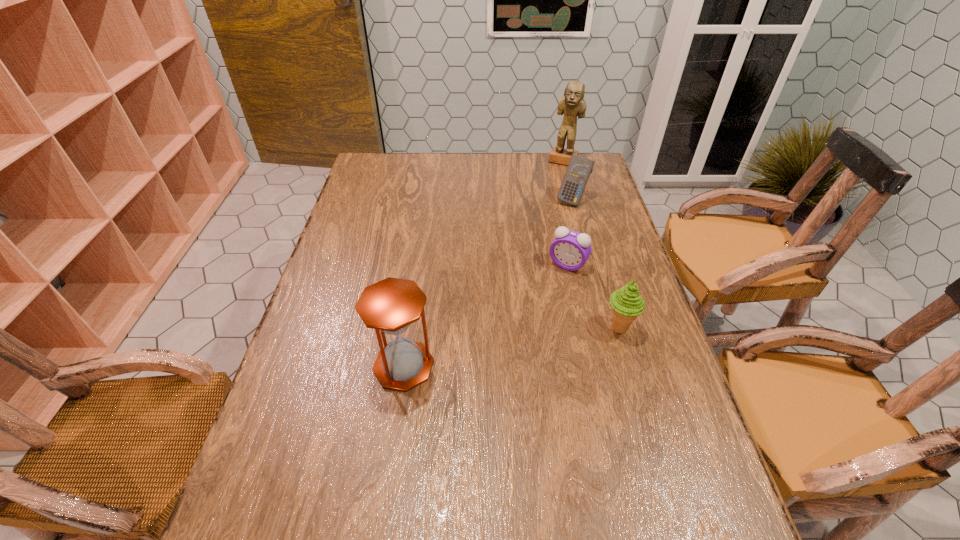
Find the location of a particular element. Image resolution: width=960 pixels, height=540 pixels. free space between the second nearest object and the second farthest object is located at coordinates (595, 264).

Image resolution: width=960 pixels, height=540 pixels. Identify the location of free space between the icecream and the fourth nearest object. (595, 264).

Locate an element on the screen. free spot between the calculator and the second tallest object is located at coordinates (488, 283).

Where is `free area in between the icecream and the hourglass`? This screenshot has width=960, height=540. free area in between the icecream and the hourglass is located at coordinates (512, 347).

Identify the location of empty space that is in between the alarm clock and the fourth shortest object. (486, 315).

Where is `vacant space that is in between the tallest object and the fourth farthest object`? Image resolution: width=960 pixels, height=540 pixels. vacant space that is in between the tallest object and the fourth farthest object is located at coordinates (591, 244).

Find the location of a particular element. This screenshot has height=540, width=960. free area in between the second farthest object and the hourglass is located at coordinates (488, 283).

Choose which object is the fourth nearest neighbor to the icecream. Please provide its 2D coordinates. Your answer should be formatted as a tuple, i.e. [(x, y)], where the tuple contains the x and y coordinates of a point satisfying the conditions above.

[(572, 104)]

Find the location of a particular element. the fourth closest object to the calculator is located at coordinates (391, 305).

At what (x,y) coordinates should I click in order to perform the action: click on vacant space that satisfies the following two spatial constraints: 1. on the back side of the third farthest object; 2. on the right side of the nearest object. Please return your answer as a coordinate pair (x, y). Looking at the image, I should click on (419, 265).